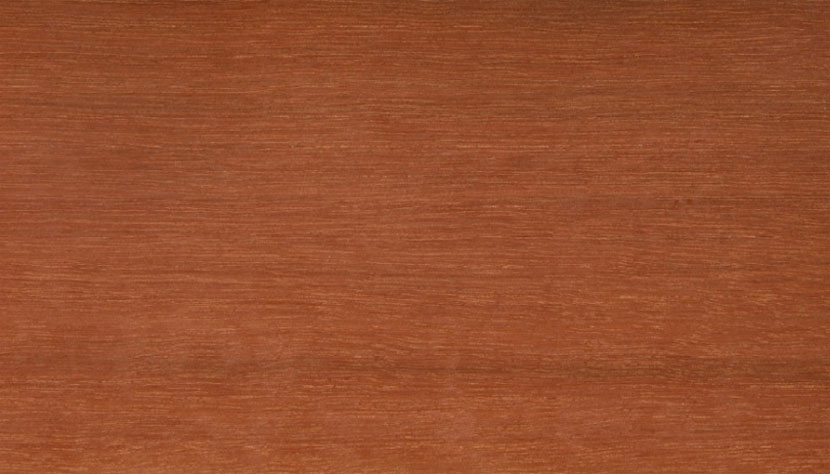
Locate an element on the screen. wood grain is located at coordinates (189, 228), (388, 236), (550, 223), (471, 367), (559, 369), (701, 371).